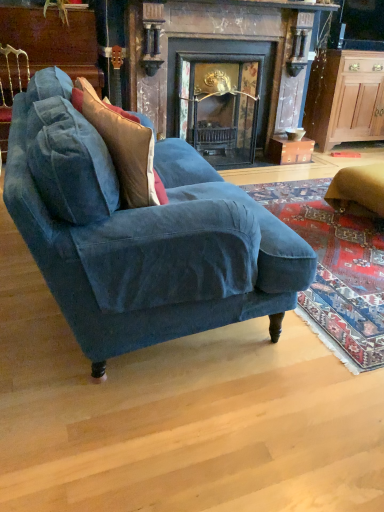
Question: From the image's perspective, is velvet blue couch at center positioned above or below wooden cabinet at right?

Choices:
 (A) above
 (B) below

Answer: (B)

Question: From a real-world perspective, relative to wooden cabinet at right, is velvet blue couch at center vertically above or below?

Choices:
 (A) below
 (B) above

Answer: (A)

Question: Which is farther from the velvet blue armchair at upper left?

Choices:
 (A) velvet cushion at left
 (B) velvet blue couch at center
 (C) wooden cabinet at right
 (D) dark wood fireplace at center

Answer: (C)

Question: Which object is positioned farthest from the velvet cushion at left?

Choices:
 (A) wooden cabinet at right
 (B) dark wood fireplace at center
 (C) velvet blue couch at center
 (D) velvet blue armchair at upper left

Answer: (A)